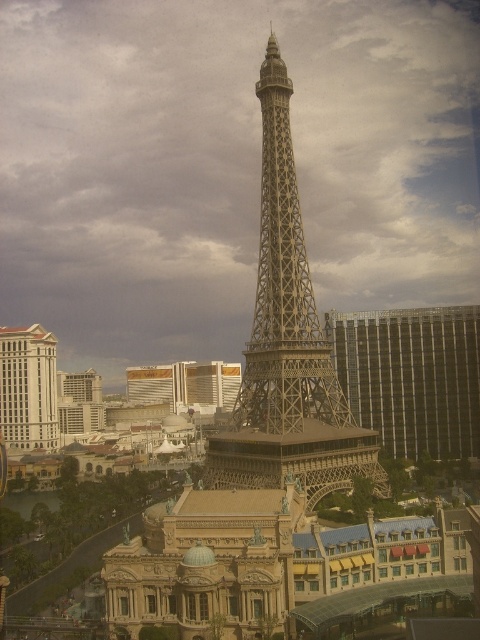
Question: Estimate the real-world distances between objects in this image. Which object is closer to the beige stone hotel at lower left?

Choices:
 (A) metallic silver building at right
 (B) metallic silver building at lower left

Answer: (B)

Question: Can you confirm if metallic silver tower at center is positioned above beige stone hotel at lower left?

Choices:
 (A) yes
 (B) no

Answer: (A)

Question: Can you confirm if metallic silver tower at center is smaller than beige stone hotel at lower left?

Choices:
 (A) yes
 (B) no

Answer: (B)

Question: Which object appears closest to the camera in this image?

Choices:
 (A) metallic silver tower at center
 (B) metallic silver building at right

Answer: (A)

Question: Which is farther from the metallic silver tower at center?

Choices:
 (A) beige stone hotel at lower left
 (B) metallic silver building at right
 (C) metallic silver building at lower left

Answer: (C)

Question: Can you confirm if metallic silver tower at center is positioned to the left of beige stone hotel at lower left?

Choices:
 (A) no
 (B) yes

Answer: (A)